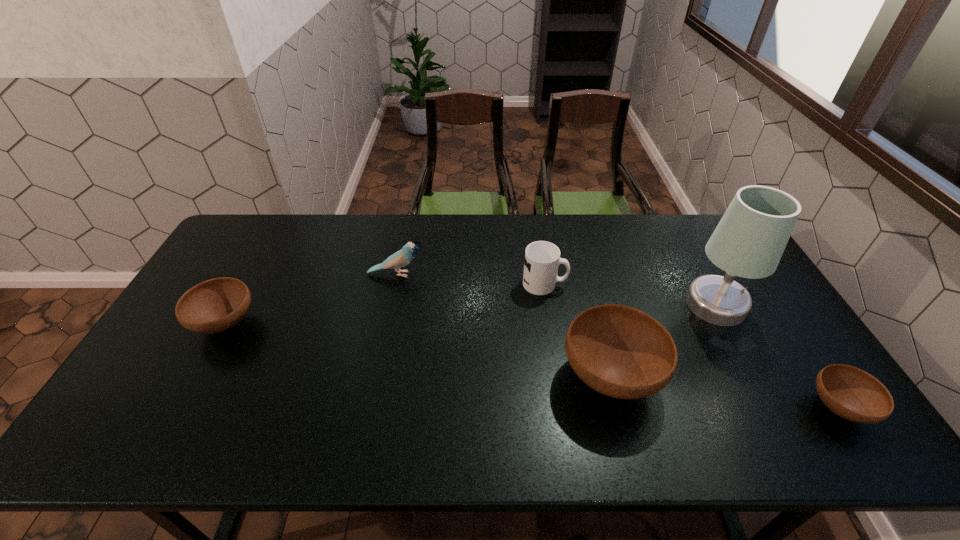
The height and width of the screenshot is (540, 960). Find the location of `vacant position for inserting another bowl evenly`. vacant position for inserting another bowl evenly is located at coordinates click(408, 348).